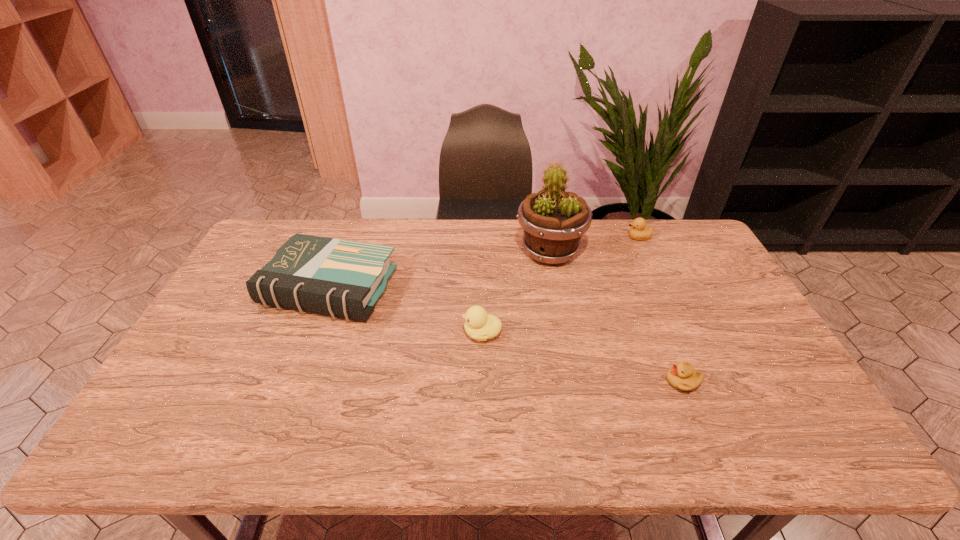
The width and height of the screenshot is (960, 540). I want to click on flowerpot present at the far edge, so click(553, 221).

Where is `paperback book located at the far edge`? Image resolution: width=960 pixels, height=540 pixels. paperback book located at the far edge is located at coordinates (340, 278).

Find the location of a particular element. The width and height of the screenshot is (960, 540). duckling that is at the far edge is located at coordinates (638, 231).

I want to click on object that is at the left edge, so click(x=340, y=278).

At what (x,y) coordinates should I click in order to perform the action: click on object that is at the far left corner. Please return your answer as a coordinate pair (x, y). Looking at the image, I should click on (340, 278).

In the image, there is a desktop. Where is `vacant space at the far edge`? The width and height of the screenshot is (960, 540). vacant space at the far edge is located at coordinates tap(509, 227).

In order to click on free point at the left edge in this screenshot , I will do `click(234, 297)`.

Identify the location of vacant region at the right edge. Image resolution: width=960 pixels, height=540 pixels. (717, 307).

Image resolution: width=960 pixels, height=540 pixels. Find the location of `blank space at the near left corner of the desktop`. blank space at the near left corner of the desktop is located at coordinates (175, 425).

Identify the location of vacant space at the far right corner of the desktop. The height and width of the screenshot is (540, 960). (692, 225).